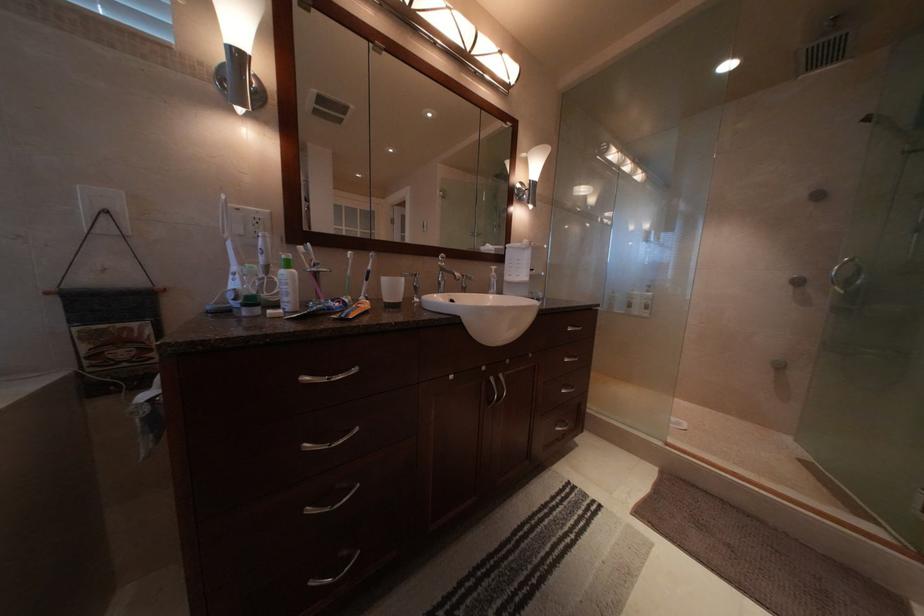
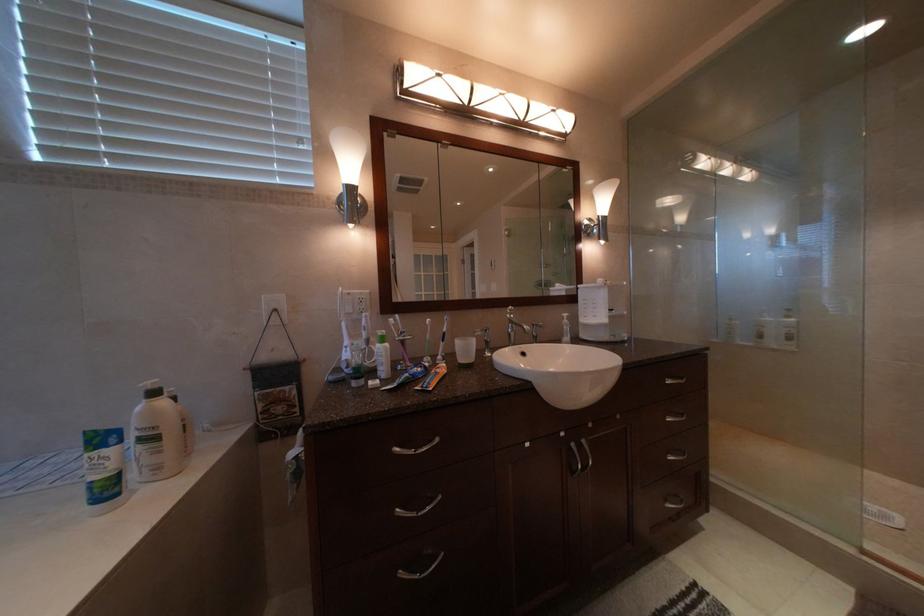
What movement of the cameraman would produce the second image?

The cameraman walked toward right, backward.